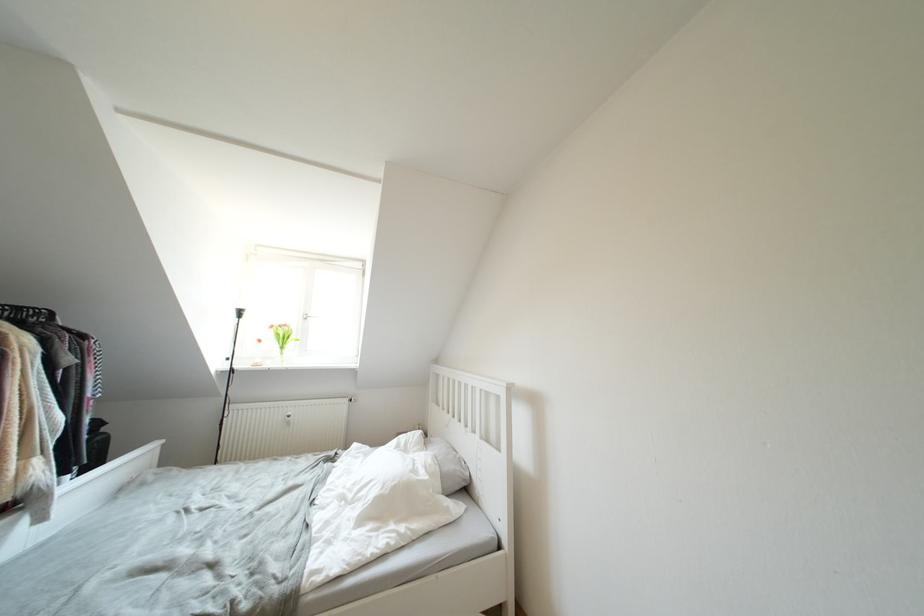
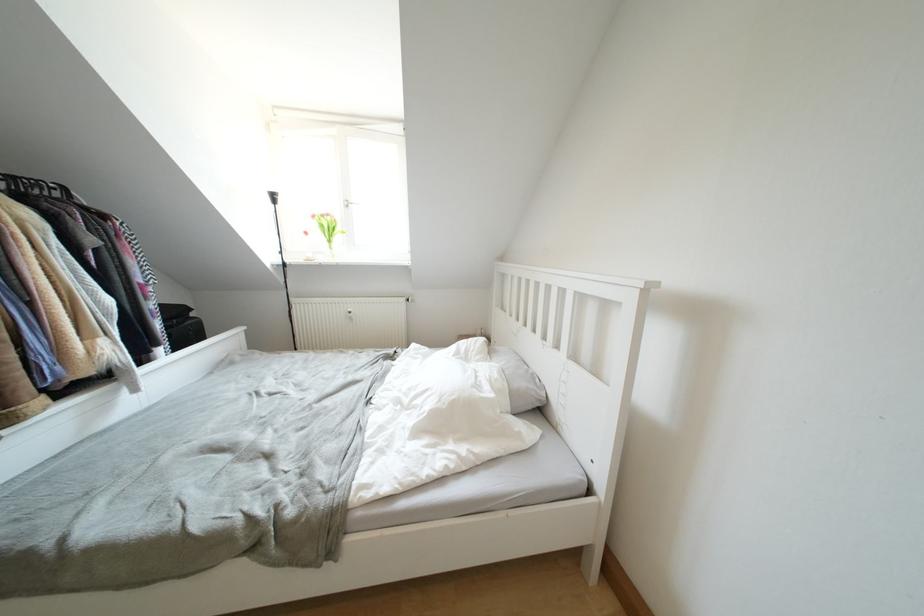
Question: Which direction would the cameraman need to move to produce the second image? Reply with the corresponding letter.

Choices:
 (A) Left
 (B) Right
 (C) Forward
 (D) Backward

Answer: (C)